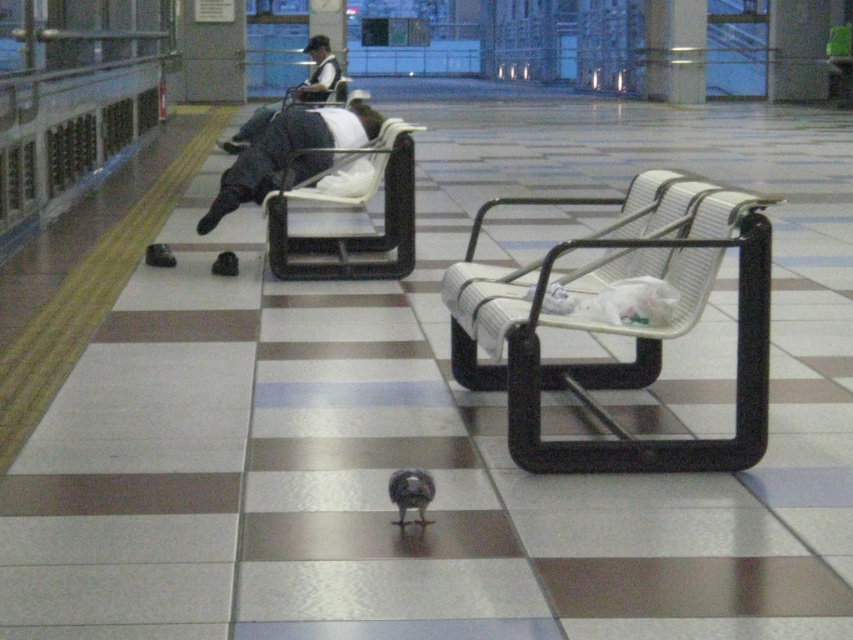
Question: Does white fabric chair at center have a larger size compared to dark gray fabric jacket at upper center?

Choices:
 (A) yes
 (B) no

Answer: (A)

Question: Does white woven bench at center have a larger size compared to white fabric chair at center?

Choices:
 (A) no
 (B) yes

Answer: (B)

Question: Which of the following is the farthest from the observer?

Choices:
 (A) (293, 99)
 (B) (518, 436)

Answer: (A)

Question: Which point appears farthest from the camera in this image?

Choices:
 (A) (270, 136)
 (B) (408, 486)

Answer: (A)

Question: Does white fabric chair at center come behind white plastic chair at upper left?

Choices:
 (A) yes
 (B) no

Answer: (B)

Question: Among these points, which one is nearest to the camera?

Choices:
 (A) (282, 109)
 (B) (299, 92)
 (C) (399, 493)
 (D) (397, 189)

Answer: (C)